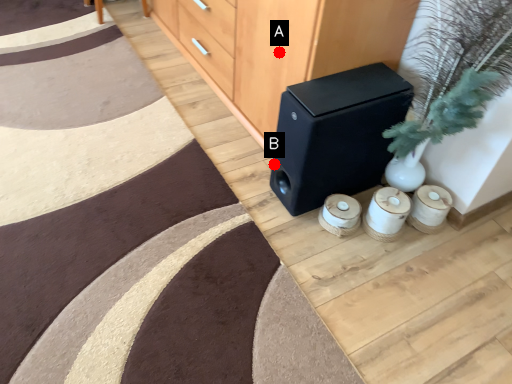
Question: Two points are circled on the image, labeled by A and B beside each circle. Which point is closer to the camera?

Choices:
 (A) A is closer
 (B) B is closer

Answer: (A)